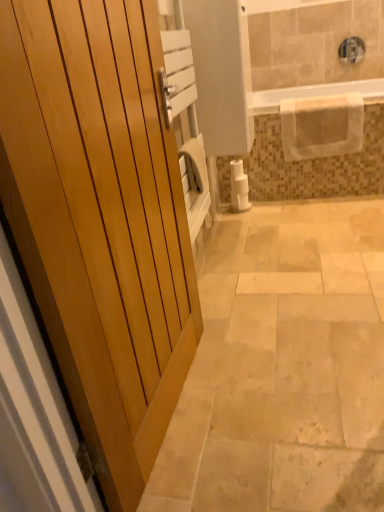
Question: Is white matte toilet paper at center-right completely or partially inside wooden door at left?

Choices:
 (A) no
 (B) yes

Answer: (A)

Question: Is white matte toilet paper at center-right at the back of wooden door at left?

Choices:
 (A) no
 (B) yes

Answer: (A)

Question: Is wooden door at left not close to white matte toilet paper at center-right?

Choices:
 (A) no
 (B) yes

Answer: (B)

Question: Considering the relative positions of wooden door at left and white matte toilet paper at center-right in the image provided, is wooden door at left to the left of white matte toilet paper at center-right from the viewer's perspective?

Choices:
 (A) yes
 (B) no

Answer: (A)

Question: Does wooden door at left have a larger size compared to white matte toilet paper at center-right?

Choices:
 (A) yes
 (B) no

Answer: (A)

Question: Is wooden door at left behind white matte toilet paper at center-right?

Choices:
 (A) yes
 (B) no

Answer: (B)

Question: Is white matte toilet paper at center-right smaller than clear plastic bathtub at upper center?

Choices:
 (A) no
 (B) yes

Answer: (B)

Question: Would you say clear plastic bathtub at upper center is part of white matte toilet paper at center-right's contents?

Choices:
 (A) yes
 (B) no

Answer: (B)

Question: Does white matte toilet paper at center-right have a lesser width compared to clear plastic bathtub at upper center?

Choices:
 (A) no
 (B) yes

Answer: (B)

Question: Does white matte toilet paper at center-right appear on the right side of clear plastic bathtub at upper center?

Choices:
 (A) yes
 (B) no

Answer: (B)

Question: Is white matte toilet paper at center-right to the left of clear plastic bathtub at upper center from the viewer's perspective?

Choices:
 (A) yes
 (B) no

Answer: (A)

Question: From a real-world perspective, is white matte toilet paper at center-right beneath clear plastic bathtub at upper center?

Choices:
 (A) no
 (B) yes

Answer: (B)

Question: Are white matte toilet paper at center-right and wooden door at left beside each other?

Choices:
 (A) yes
 (B) no

Answer: (B)